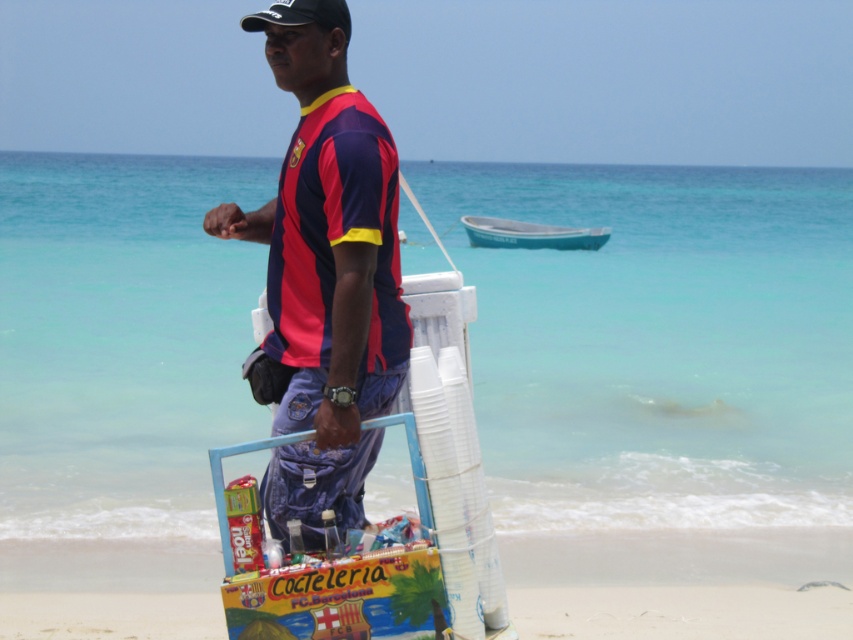
Between matte red and blue jersey at center and white plastic cups at center, which one appears on the left side from the viewer's perspective?

From the viewer's perspective, matte red and blue jersey at center appears more on the left side.

Is point (381, 401) more distant than point (57, 570)?

No.

Which is behind, point (361, 172) or point (543, 557)?

Positioned behind is point (543, 557).

Identify the location of matte red and blue jersey at center. This screenshot has width=853, height=640. [x=325, y=284].

Between white plastic cups at center and teal plastic boat at center, which one appears on the right side from the viewer's perspective?

Positioned to the right is teal plastic boat at center.

The height and width of the screenshot is (640, 853). In order to click on white plastic cups at center in this screenshot , I will do `click(679, 582)`.

Between point (326, 156) and point (605, 232), which one is positioned behind?

Point (605, 232)

Is point (285, 504) in front of point (595, 230)?

Yes, point (285, 504) is in front of point (595, 230).

Where is `matte red and blue jersey at center`? This screenshot has height=640, width=853. matte red and blue jersey at center is located at coordinates (325, 284).